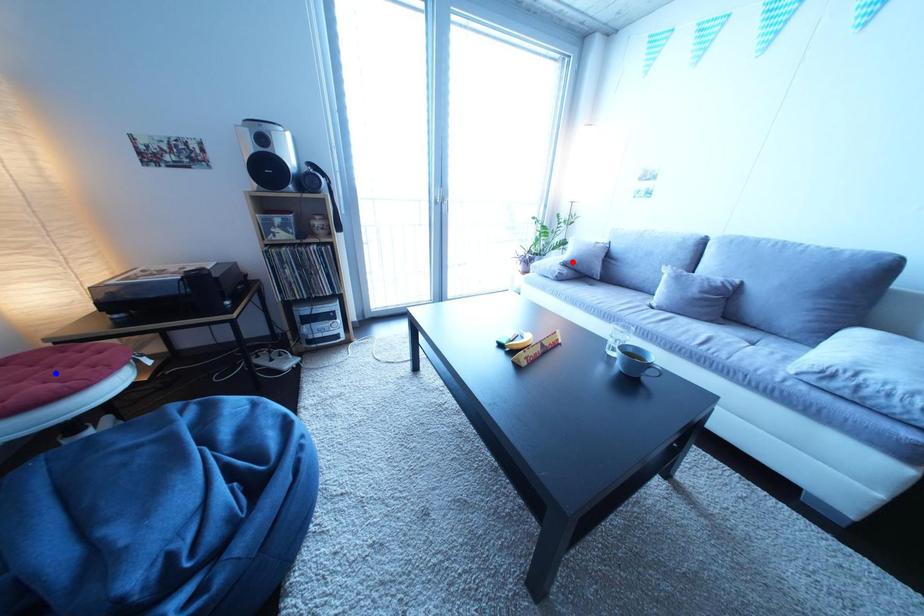
Question: Which of the two points in the image is closer to the camera?

Choices:
 (A) Blue point is closer.
 (B) Red point is closer.

Answer: (A)